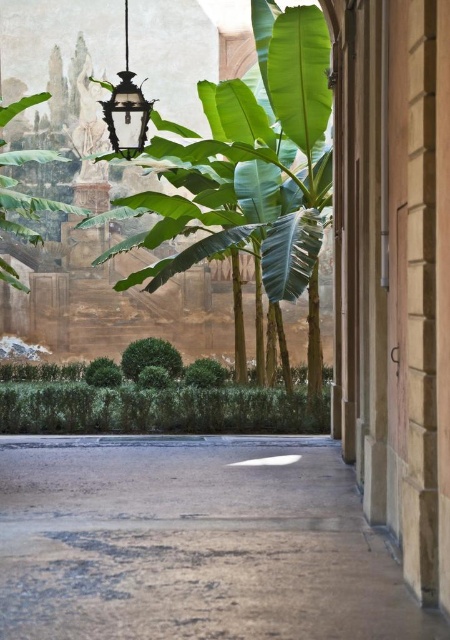
Question: Estimate the real-world distances between objects in this image. Which object is closer to the concrete sidewalk at center?

Choices:
 (A) green leafy banana tree at upper left
 (B) black glass lantern at upper left
 (C) green leafy shrubs at center

Answer: (C)

Question: Does concrete sidewalk at center lie in front of green leafy banana tree at upper left?

Choices:
 (A) yes
 (B) no

Answer: (A)

Question: Observing the image, what is the correct spatial positioning of green leafy banana tree at upper left in reference to green leafy shrubs at center?

Choices:
 (A) above
 (B) below

Answer: (A)

Question: Which of the following is the farthest from the observer?

Choices:
 (A) black glass lantern at upper left
 (B) green leafy banana tree at upper left

Answer: (B)

Question: Can you confirm if green leafy banana tree at upper left is bigger than green leafy shrubs at center?

Choices:
 (A) yes
 (B) no

Answer: (A)

Question: Which point is closer to the camera?

Choices:
 (A) black glass lantern at upper left
 (B) concrete sidewalk at center
 (C) green leafy shrubs at center
 (D) green leafy banana tree at upper left

Answer: (B)